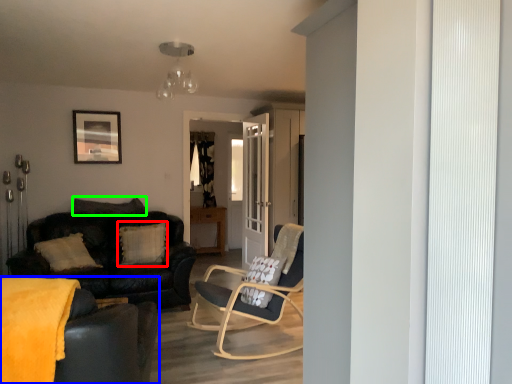
Question: Which object is positioned closest to pillow (highlighted by a red box)? Select from studio couch (highlighted by a blue box) and pillow (highlighted by a green box).

Choices:
 (A) studio couch
 (B) pillow

Answer: (B)